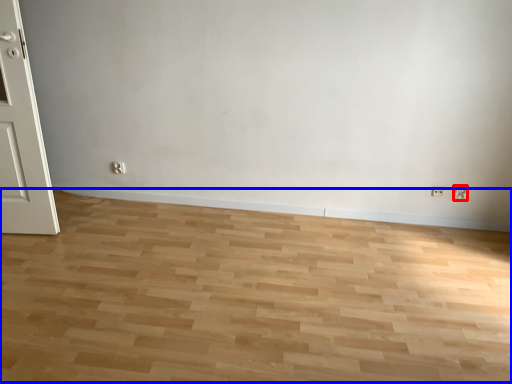
Question: Which object appears closest to the camera in this image, electric outlet (highlighted by a red box) or plain (highlighted by a blue box)?

Choices:
 (A) electric outlet
 (B) plain

Answer: (B)